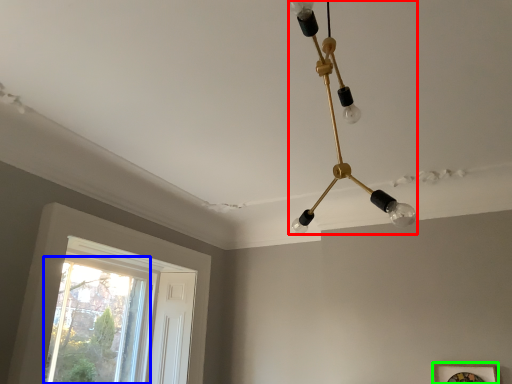
Question: Which object is positioned farthest from lamp (highlighted by a red box)? Select from window (highlighted by a blue box) and picture frame (highlighted by a green box).

Choices:
 (A) window
 (B) picture frame

Answer: (A)